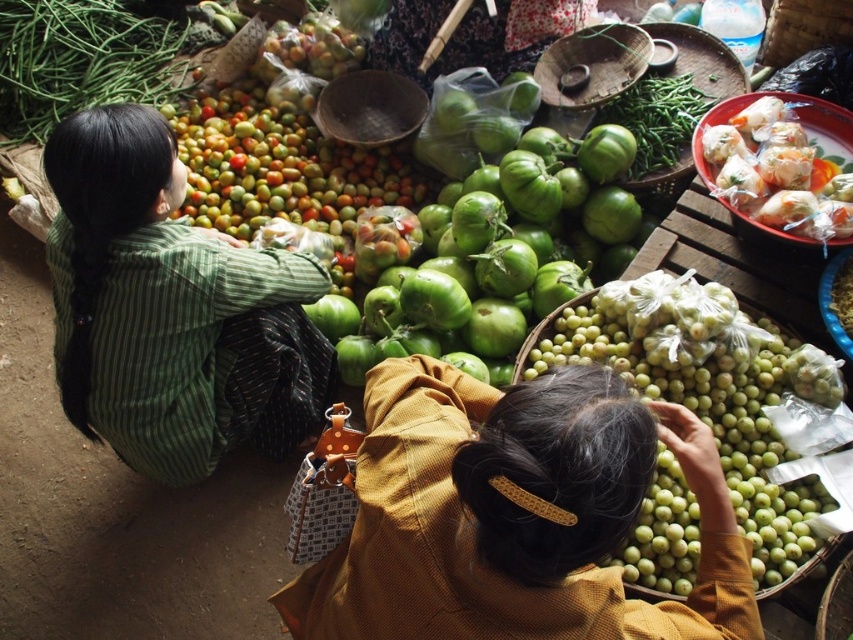
Is green matte tomato at upper center thinner than bamboo basket at upper right?

Incorrect, green matte tomato at upper center's width is not less than bamboo basket at upper right's.

Does green matte tomato at upper center have a greater height compared to bamboo basket at upper right?

Indeed, green matte tomato at upper center has a greater height compared to bamboo basket at upper right.

In order to click on green matte tomato at upper center in this screenshot , I will do `click(656, 120)`.

Between point (526, 396) and point (674, 352), which one is positioned in front?

Point (526, 396)

What do you see at coordinates (515, 515) in the screenshot? Image resolution: width=853 pixels, height=640 pixels. I see `matte yellow shirt at lower center` at bounding box center [515, 515].

I want to click on matte yellow shirt at lower center, so click(x=515, y=515).

Who is more forward, (x=390, y=624) or (x=553, y=189)?

Point (x=390, y=624) is in front.

Is point (497, 518) closer to viewer compared to point (367, 323)?

Yes, it is in front of point (367, 323).

At what (x,y) coordinates should I click in order to perform the action: click on matte yellow shirt at lower center. Please return your answer as a coordinate pair (x, y). The height and width of the screenshot is (640, 853). Looking at the image, I should click on (515, 515).